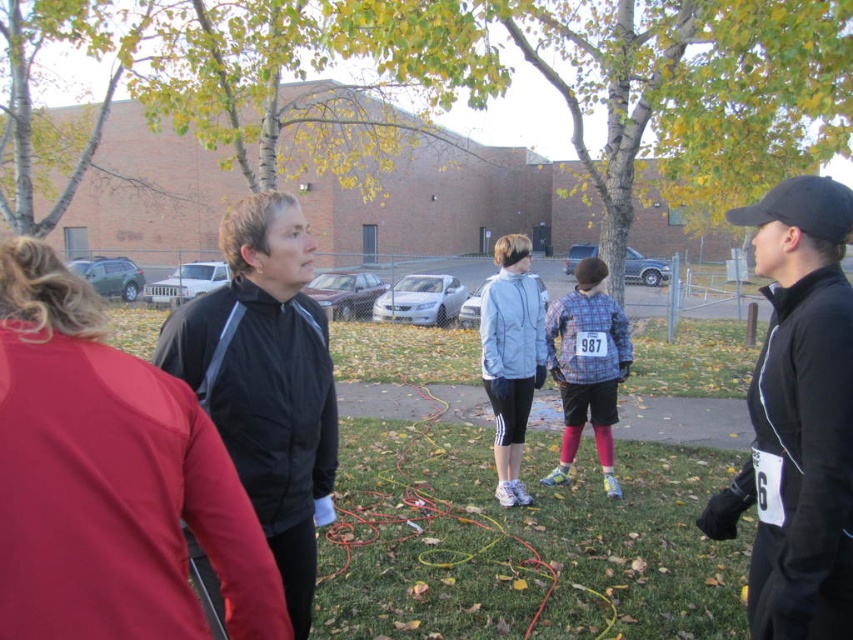
You are a photographer at a community event and need to capture a clear shot of both the matte black jacket at center and the black matte jacket at left. Can you see both jackets fully in your current position?

The matte black jacket at center is in front of the black matte jacket at left, so you cannot see both jackets fully in your current position because the matte black jacket at center is blocking the view of the black matte jacket at left.

You are standing at the center of the image and want to hand a flyer to the person wearing the matte black jacket at center. Based on their position, can you estimate how far to your right or left you need to move to reach them?

The matte black jacket at center is located at point 0.750 on the x and 0.129 on the y axis. Since the x coordinate is 0.750, which is to the right of the center point, you would need to move to your right to reach them.

You are organizing a group photo and need to arrange the matte black jacket at center and plaid fabric shirt at center so that both are visible. Given their sizes, which should be placed closer to the camera to ensure both fit in the frame?

Since the matte black jacket at center occupies less space than the plaid fabric shirt at center, placing the plaid fabric shirt at center closer to the camera will allow both to be visible in the frame as the larger object needs to be nearer for proper framing.